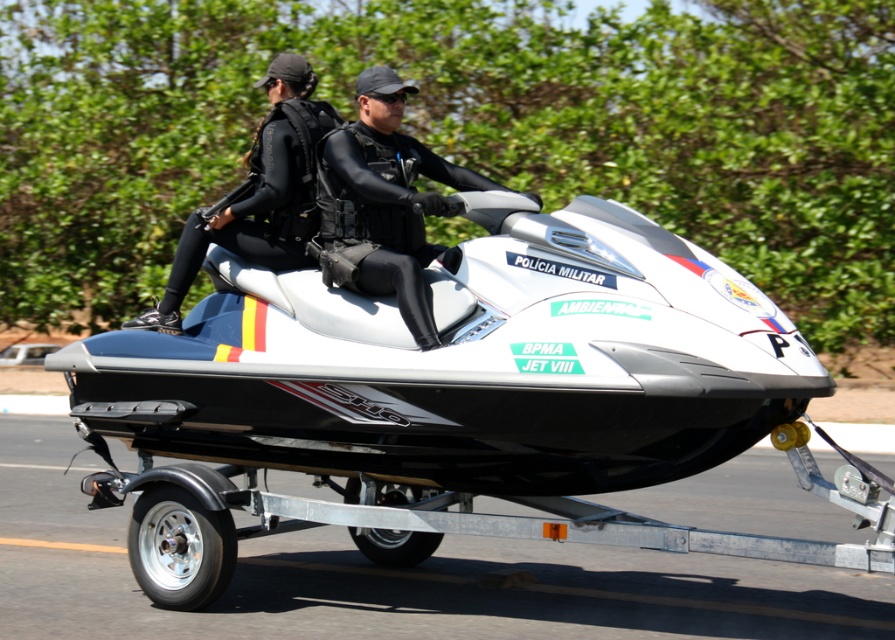
Question: Considering the relative positions of white matte jet ski at center and black matte wetsuit at left in the image provided, where is white matte jet ski at center located with respect to black matte wetsuit at left?

Choices:
 (A) left
 (B) right

Answer: (B)

Question: Is the position of white matte jet ski at center less distant than that of black matte wetsuit at left?

Choices:
 (A) no
 (B) yes

Answer: (B)

Question: Which point is closer to the camera?

Choices:
 (A) black matte wetsuit at center
 (B) black matte wetsuit at left

Answer: (A)

Question: Does white matte jet ski at center have a larger size compared to black matte wetsuit at center?

Choices:
 (A) yes
 (B) no

Answer: (A)

Question: Estimate the real-world distances between objects in this image. Which object is farther from the white matte jet ski at center?

Choices:
 (A) black matte wetsuit at center
 (B) black matte wetsuit at left

Answer: (B)

Question: Which is farther from the black matte wetsuit at left?

Choices:
 (A) black matte wetsuit at center
 (B) white matte jet ski at center

Answer: (B)